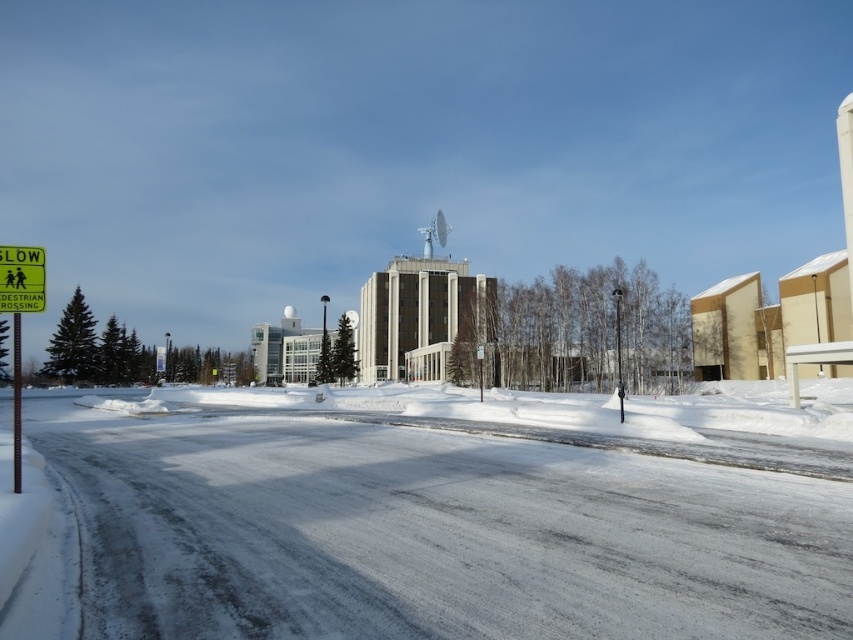
Question: Which object is farther from the camera taking this photo?

Choices:
 (A) yellow plastic sign at left
 (B) metallic pole at left

Answer: (B)

Question: From the image, what is the correct spatial relationship of white powdery snow at center in relation to metallic pole at left?

Choices:
 (A) left
 (B) right

Answer: (B)

Question: Is white powdery snow at center below yellow plastic sign at left?

Choices:
 (A) no
 (B) yes

Answer: (B)

Question: Among these points, which one is nearest to the camera?

Choices:
 (A) (817, 538)
 (B) (19, 333)
 (C) (0, 269)

Answer: (A)

Question: Observing the image, what is the correct spatial positioning of white powdery snow at center in reference to metallic pole at left?

Choices:
 (A) below
 (B) above

Answer: (A)

Question: Among these objects, which one is nearest to the camera?

Choices:
 (A) white powdery snow at center
 (B) yellow plastic sign at left

Answer: (A)